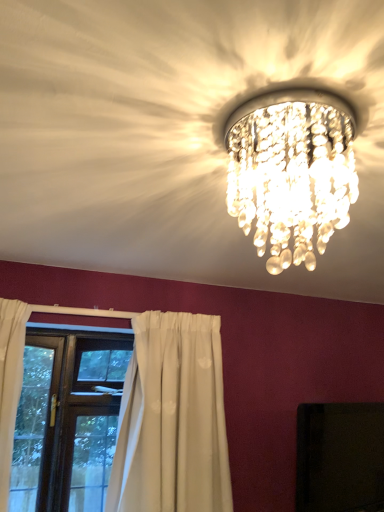
Question: Is brown wooden window at lower left outside clear crystal chandelier at upper center?

Choices:
 (A) yes
 (B) no

Answer: (A)

Question: Is brown wooden window at lower left positioned in front of clear crystal chandelier at upper center?

Choices:
 (A) no
 (B) yes

Answer: (A)

Question: Does brown wooden window at lower left have a smaller size compared to clear crystal chandelier at upper center?

Choices:
 (A) no
 (B) yes

Answer: (A)

Question: From a real-world perspective, is brown wooden window at lower left below clear crystal chandelier at upper center?

Choices:
 (A) no
 (B) yes

Answer: (B)

Question: Is brown wooden window at lower left to the left of clear crystal chandelier at upper center from the viewer's perspective?

Choices:
 (A) yes
 (B) no

Answer: (A)

Question: From the image's perspective, would you say brown wooden window at lower left is positioned over clear crystal chandelier at upper center?

Choices:
 (A) yes
 (B) no

Answer: (B)

Question: Does brown wooden window at lower left have a lesser height compared to black glossy tv at upper center?

Choices:
 (A) no
 (B) yes

Answer: (A)

Question: Does brown wooden window at lower left have a greater height compared to black glossy tv at upper center?

Choices:
 (A) yes
 (B) no

Answer: (A)

Question: Considering the relative sizes of brown wooden window at lower left and black glossy tv at upper center in the image provided, is brown wooden window at lower left smaller than black glossy tv at upper center?

Choices:
 (A) yes
 (B) no

Answer: (B)

Question: From a real-world perspective, is brown wooden window at lower left below black glossy tv at upper center?

Choices:
 (A) yes
 (B) no

Answer: (B)

Question: From a real-world perspective, is brown wooden window at lower left on top of black glossy tv at upper center?

Choices:
 (A) no
 (B) yes

Answer: (B)

Question: Considering the relative sizes of brown wooden window at lower left and black glossy tv at upper center in the image provided, is brown wooden window at lower left wider than black glossy tv at upper center?

Choices:
 (A) no
 (B) yes

Answer: (B)

Question: Is the position of black glossy tv at upper center more distant than that of brown wooden window at lower left?

Choices:
 (A) no
 (B) yes

Answer: (A)